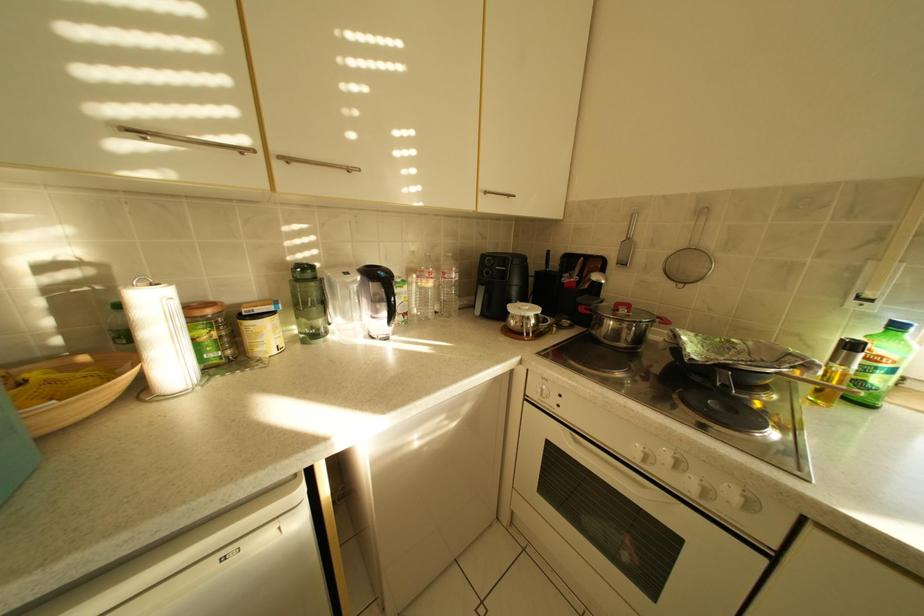
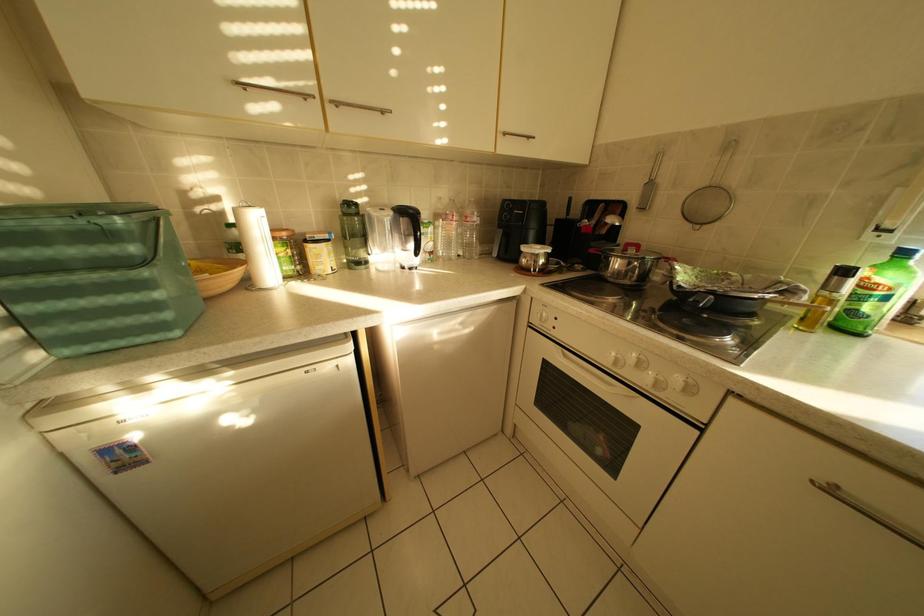
What movement of the cameraman would produce the second image?

The movement direction of the cameraman is right, backward.